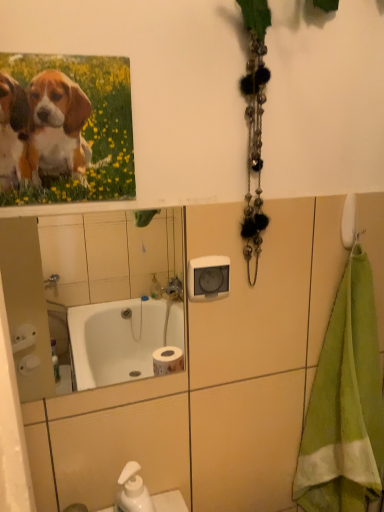
Question: Does white glossy mirror at upper center have a lesser width compared to matte canvas print of puppies at upper left?

Choices:
 (A) yes
 (B) no

Answer: (A)

Question: Can you confirm if white glossy mirror at upper center is bigger than matte canvas print of puppies at upper left?

Choices:
 (A) no
 (B) yes

Answer: (B)

Question: Does white glossy mirror at upper center contain matte canvas print of puppies at upper left?

Choices:
 (A) no
 (B) yes

Answer: (A)

Question: Is white glossy mirror at upper center shorter than matte canvas print of puppies at upper left?

Choices:
 (A) no
 (B) yes

Answer: (A)

Question: Is white glossy mirror at upper center positioned beyond the bounds of matte canvas print of puppies at upper left?

Choices:
 (A) no
 (B) yes

Answer: (B)

Question: Choose the correct answer: Is green terry cloth towel at right inside matte canvas print of puppies at upper left or outside it?

Choices:
 (A) inside
 (B) outside

Answer: (B)

Question: Does point (370, 401) appear closer or farther from the camera than point (1, 119)?

Choices:
 (A) farther
 (B) closer

Answer: (A)

Question: Is green terry cloth towel at right bigger or smaller than matte canvas print of puppies at upper left?

Choices:
 (A) small
 (B) big

Answer: (B)

Question: Is green terry cloth towel at right in front of or behind matte canvas print of puppies at upper left in the image?

Choices:
 (A) front
 (B) behind

Answer: (B)

Question: Is white glossy mirror at upper center situated inside matte canvas print of puppies at upper left or outside?

Choices:
 (A) outside
 (B) inside

Answer: (A)

Question: Looking at their shapes, would you say white glossy mirror at upper center is wider or thinner than matte canvas print of puppies at upper left?

Choices:
 (A) wide
 (B) thin

Answer: (B)

Question: Considering their positions, is white glossy mirror at upper center located in front of or behind matte canvas print of puppies at upper left?

Choices:
 (A) front
 (B) behind

Answer: (B)

Question: Is white glossy mirror at upper center to the left or to the right of matte canvas print of puppies at upper left in the image?

Choices:
 (A) left
 (B) right

Answer: (A)

Question: Is white glossy mirror at upper center taller or shorter than green terry cloth towel at right?

Choices:
 (A) short
 (B) tall

Answer: (A)

Question: In the image, is white glossy mirror at upper center on the left side or the right side of green terry cloth towel at right?

Choices:
 (A) left
 (B) right

Answer: (A)